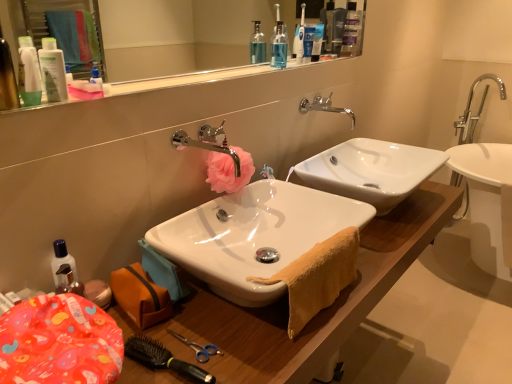
Identify the location of vacant space in front of yellow terry cloth towel at lower center. Image resolution: width=512 pixels, height=384 pixels. (284, 352).